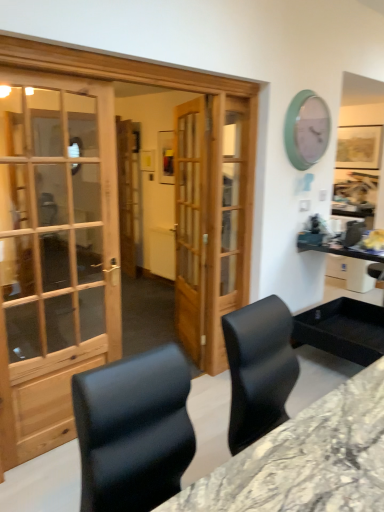
Question: Is wooden door at center wider or thinner than marble/black desk at center?

Choices:
 (A) thin
 (B) wide

Answer: (A)

Question: Is point (187, 286) closer or farther from the camera than point (243, 464)?

Choices:
 (A) closer
 (B) farther

Answer: (B)

Question: Considering the real-world distances, which object is closest to the wooden door at center?

Choices:
 (A) teal plastic clock at upper right
 (B) marble/black desk at center

Answer: (A)

Question: Which is farther from the wooden door at center?

Choices:
 (A) teal plastic clock at upper right
 (B) marble/black desk at center

Answer: (B)